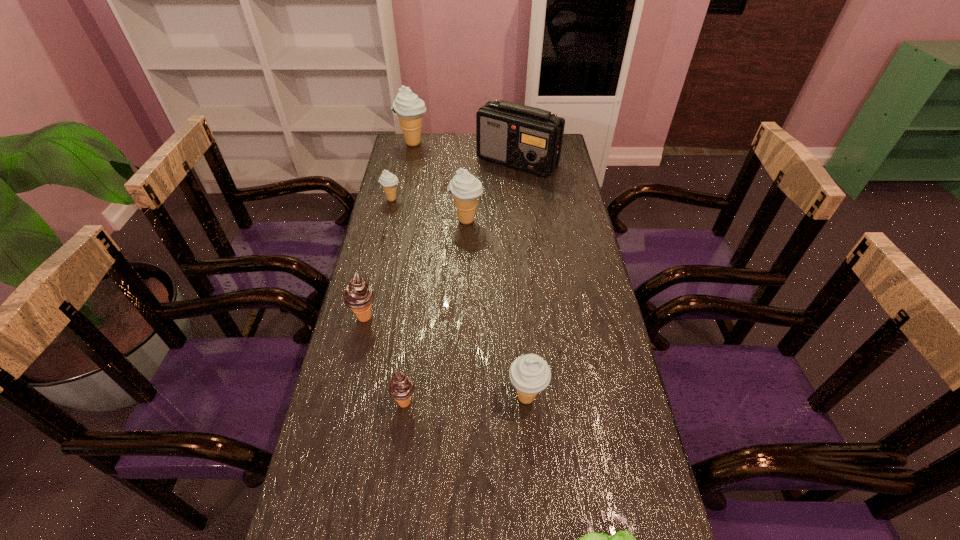
Find the location of a particular element. empty space between the nearer chocolate icecream and the sixth nearest object is located at coordinates tap(398, 301).

I want to click on vacant space that's between the fifth farthest object and the tallest icecream, so click(x=389, y=230).

Where is `vacant point located between the nearer chocolate icecream and the second nearest beige icecream`? This screenshot has width=960, height=540. vacant point located between the nearer chocolate icecream and the second nearest beige icecream is located at coordinates (435, 311).

Image resolution: width=960 pixels, height=540 pixels. In order to click on vacant space that's between the fourth farthest object and the radio receiver in this screenshot , I will do `click(492, 191)`.

This screenshot has width=960, height=540. What are the coordinates of `free space between the third nearest beige icecream and the fourth nearest object` in the screenshot? It's located at (378, 258).

Where is `free space between the smaller chocolate icecream and the tallest icecream`? free space between the smaller chocolate icecream and the tallest icecream is located at coordinates [x=409, y=273].

The height and width of the screenshot is (540, 960). In order to click on free area in between the radio receiver and the fifth icecream from left to right in this screenshot , I will do `click(492, 191)`.

Where is `vacant point located between the radio receiver and the left chocolate icecream`? vacant point located between the radio receiver and the left chocolate icecream is located at coordinates (442, 239).

Where is `unoccupied area between the radio receiver and the fourth nearest object`? unoccupied area between the radio receiver and the fourth nearest object is located at coordinates (442, 239).

Point out which object is positioned as the sixth nearest to the farthest icecream. Please provide its 2D coordinates. Your answer should be formatted as a tuple, i.e. [(x, y)], where the tuple contains the x and y coordinates of a point satisfying the conditions above.

[(530, 374)]